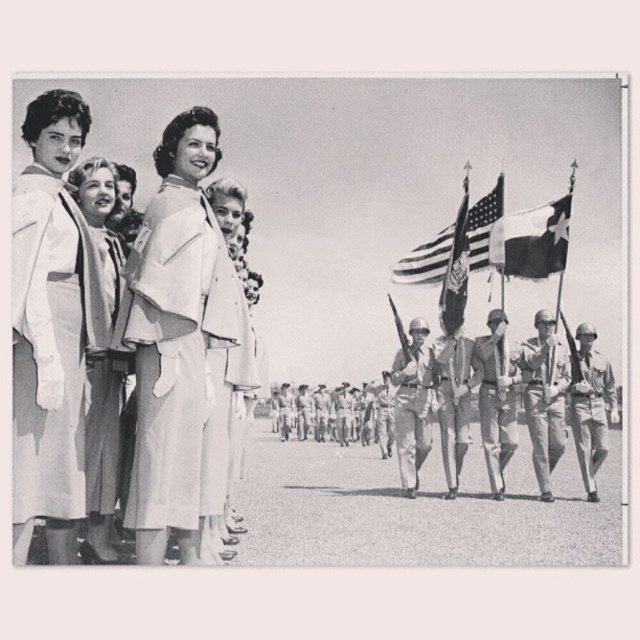
Question: Estimate the real-world distances between objects in this image. Which object is closer to the american flag at upper center?

Choices:
 (A) metallic helmet at center
 (B) white fabric dress at left
 (C) khaki uniform pants at center

Answer: (A)

Question: Can you confirm if light beige fabric dress at center is positioned to the right of khaki cotton pants at right?

Choices:
 (A) yes
 (B) no

Answer: (B)

Question: In this image, where is khaki uniform pants at center located relative to american flag at upper center?

Choices:
 (A) below
 (B) above

Answer: (A)

Question: Which is farther from the light beige fabric coat at upper center?

Choices:
 (A) silky white dress at center
 (B) camouflage fabric uniform at center

Answer: (B)

Question: Which object appears farthest from the camera in this image?

Choices:
 (A) khaki cotton pants at right
 (B) camouflage fabric uniform at center
 (C) american flag at upper center
 (D) silky white dress at center

Answer: (C)

Question: Does white cotton uniform at left appear over camouflage fabric uniform at center?

Choices:
 (A) no
 (B) yes

Answer: (B)